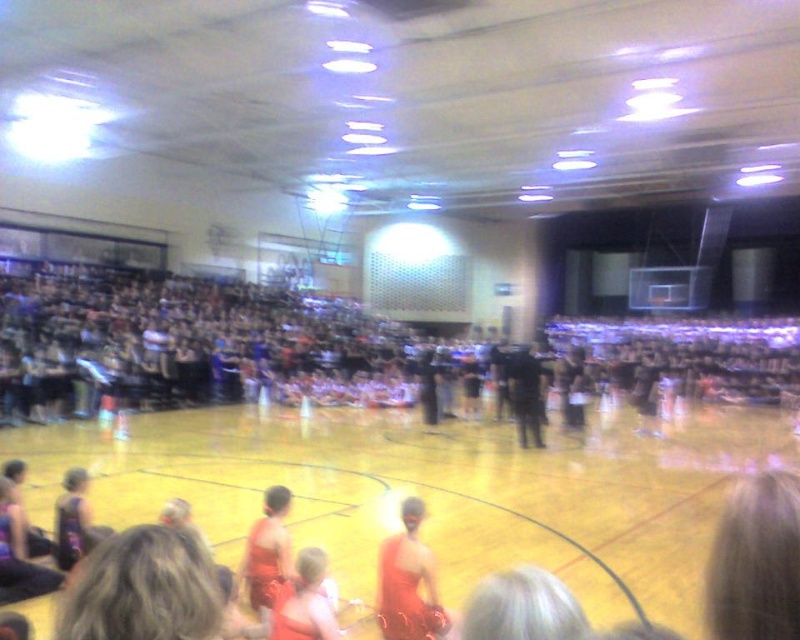
Question: Does matte red shorts at center appear over black matte uniform at center?

Choices:
 (A) yes
 (B) no

Answer: (B)

Question: Is dark gray fabric crowd at upper left to the left of shiny red dress at center from the viewer's perspective?

Choices:
 (A) yes
 (B) no

Answer: (B)

Question: Is shiny red dress at center smaller than black matte uniform at center?

Choices:
 (A) yes
 (B) no

Answer: (A)

Question: Which point appears farthest from the camera in this image?

Choices:
 (A) (510, 397)
 (B) (160, 316)
 (C) (244, 563)

Answer: (B)

Question: Which object appears closest to the camera in this image?

Choices:
 (A) black matte uniform at center
 (B) shiny red dress at center
 (C) matte red shorts at center

Answer: (B)

Question: Which object is closer to the camera taking this photo?

Choices:
 (A) matte red shorts at center
 (B) dark gray fabric crowd at upper left
 (C) black matte uniform at center
 (D) shiny red dress at center

Answer: (D)